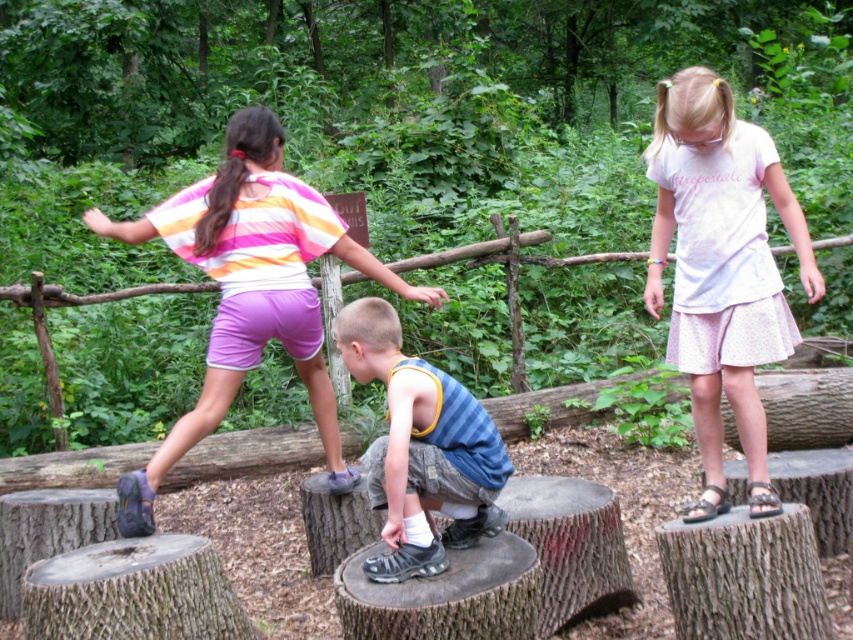
Is point (749, 440) less distant than point (253, 364)?

Yes, it is.

Can you confirm if pale pink fabric skirt at center is taller than matte pink shorts at left?

No, pale pink fabric skirt at center is not taller than matte pink shorts at left.

I want to click on pale pink fabric skirt at center, so click(x=721, y=268).

Which is behind, point (782, 221) or point (421, 436)?

Point (782, 221)

Who is positioned more to the right, pale pink fabric skirt at center or blue striped tank top at center?

pale pink fabric skirt at center is more to the right.

Does point (753, 275) come closer to viewer compared to point (397, 332)?

No, (753, 275) is behind (397, 332).

Locate an element on the screen. pale pink fabric skirt at center is located at coordinates (721, 268).

Who is lower down, matte pink shorts at left or blue striped tank top at center?

Positioned lower is blue striped tank top at center.

Which is more to the left, matte pink shorts at left or blue striped tank top at center?

matte pink shorts at left is more to the left.

At what (x,y) coordinates should I click in order to perform the action: click on matte pink shorts at left. Please return your answer as a coordinate pair (x, y). The width and height of the screenshot is (853, 640). Looking at the image, I should click on (250, 289).